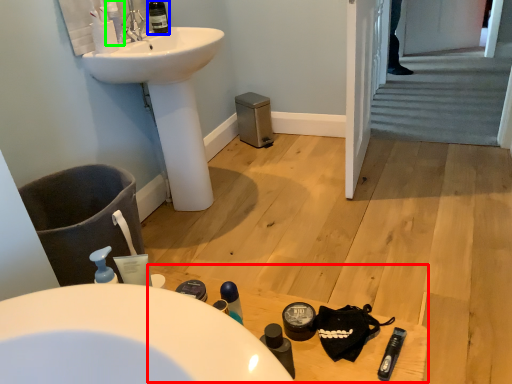
Question: Which object is the farthest from table (highlighted by a red box)? Choose among these: wine bottle (highlighted by a blue box) or mouthwash (highlighted by a green box).

Choices:
 (A) wine bottle
 (B) mouthwash

Answer: (A)